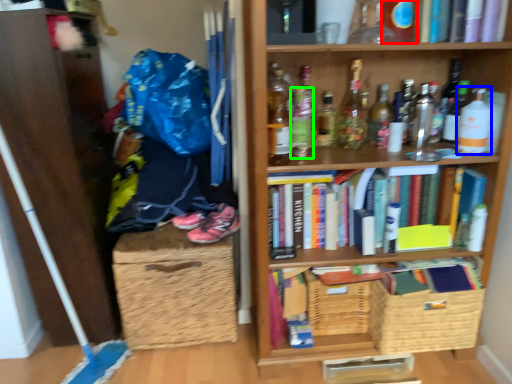
Question: Considering the real-world distances, which object is farthest from bottle (highlighted by a red box)? bottle (highlighted by a blue box) or bottle (highlighted by a green box)?

Choices:
 (A) bottle
 (B) bottle

Answer: (B)